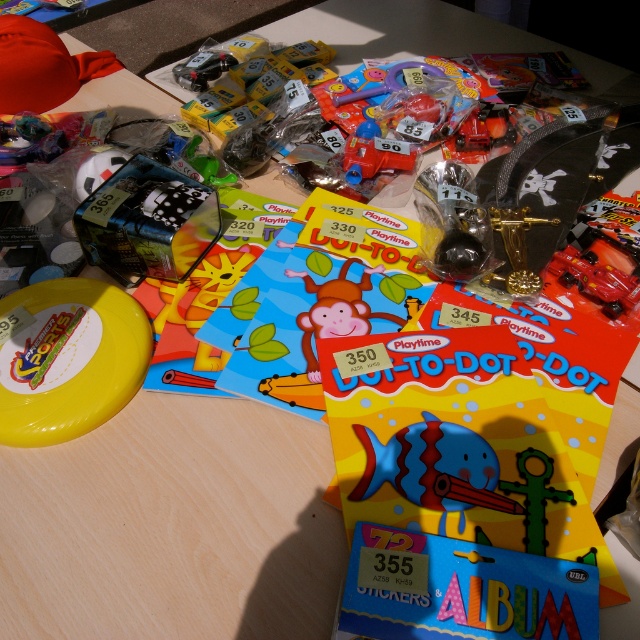
Question: Does matte yellow frisbee at center appear on the left side of green plastic sword at center?

Choices:
 (A) yes
 (B) no

Answer: (A)

Question: Does matte yellow frisbee at center appear on the right side of shiny red car at center?

Choices:
 (A) yes
 (B) no

Answer: (B)

Question: In this image, where is green plastic sword at center located relative to translucent plastic toy car at center?

Choices:
 (A) above
 (B) below

Answer: (B)

Question: Which object appears farthest from the camera in this image?

Choices:
 (A) matte yellow frisbee at center
 (B) matte plastic fish at center
 (C) shiny red car at center
 (D) translucent plastic toy car at center

Answer: (D)

Question: Among these points, which one is farthest from the camera?

Choices:
 (A) (540, 516)
 (B) (353, 285)
 (C) (397, 163)

Answer: (C)

Question: Which point is farther to the camera?

Choices:
 (A) translucent plastic toy car at center
 (B) matte plastic fish at center
 (C) matte yellow frisbee at center

Answer: (A)